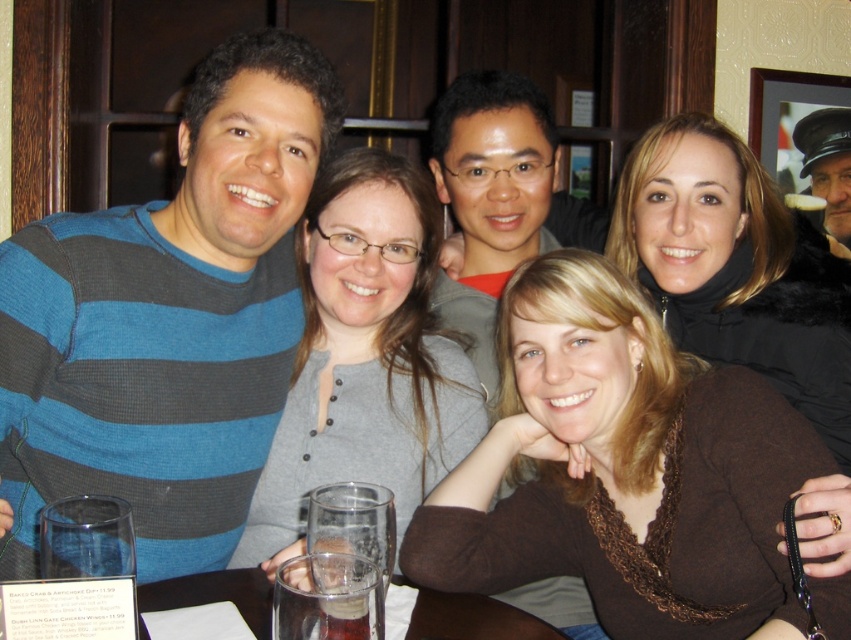
Question: Which point is closer to the camera?

Choices:
 (A) (460, 605)
 (B) (292, 186)

Answer: (A)

Question: Is gray button-up shirt at center to the left of clear glass at table center from the viewer's perspective?

Choices:
 (A) no
 (B) yes

Answer: (B)

Question: Which point is closer to the camera?

Choices:
 (A) brown fuzzy coat at upper right
 (B) clear glass water at lower center
 (C) clear glass at table center

Answer: (C)

Question: Is gray button-up shirt at center wider than clear glass water at lower center?

Choices:
 (A) yes
 (B) no

Answer: (B)

Question: Where is brown textured sweater at center located in relation to clear glass water at lower center in the image?

Choices:
 (A) left
 (B) right

Answer: (B)

Question: Among these points, which one is farthest from the camera?

Choices:
 (A) (700, 300)
 (B) (313, 196)

Answer: (A)